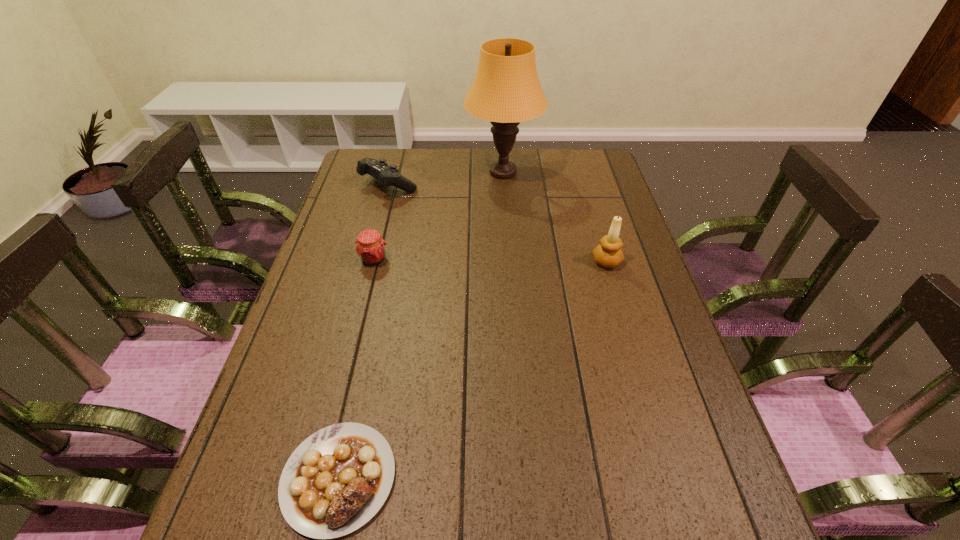
The height and width of the screenshot is (540, 960). Find the location of `lampshade`. lampshade is located at coordinates (506, 90).

The width and height of the screenshot is (960, 540). I want to click on the fourth object from left to right, so click(x=506, y=90).

Find the location of a particular element. the fourth shortest object is located at coordinates (608, 254).

The image size is (960, 540). What are the coordinates of `the rightmost object` in the screenshot? It's located at (608, 254).

Locate an element on the screen. Image resolution: width=960 pixels, height=540 pixels. control is located at coordinates (387, 176).

The height and width of the screenshot is (540, 960). Find the location of `jam`. jam is located at coordinates (370, 247).

Find the location of a particular element. This screenshot has height=540, width=960. free space located 0.160m on the front of the lampshade is located at coordinates (506, 224).

Where is `free space located 0.120m on the left of the rightmost object`? free space located 0.120m on the left of the rightmost object is located at coordinates (549, 261).

In order to click on vacant area situated on the front of the control in this screenshot , I will do `click(362, 293)`.

Identify the location of vacant area situated 0.400m on the front of the jam. This screenshot has width=960, height=540. (339, 400).